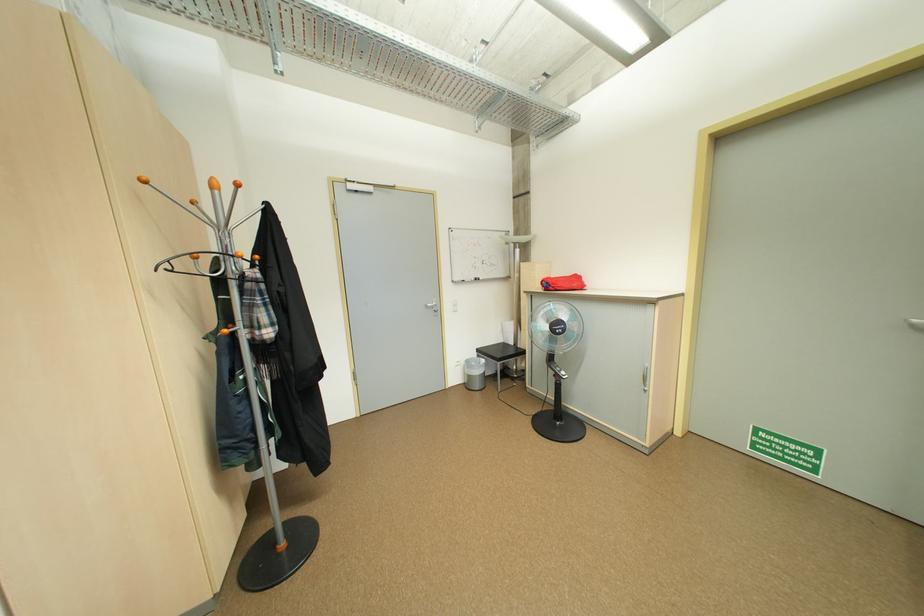
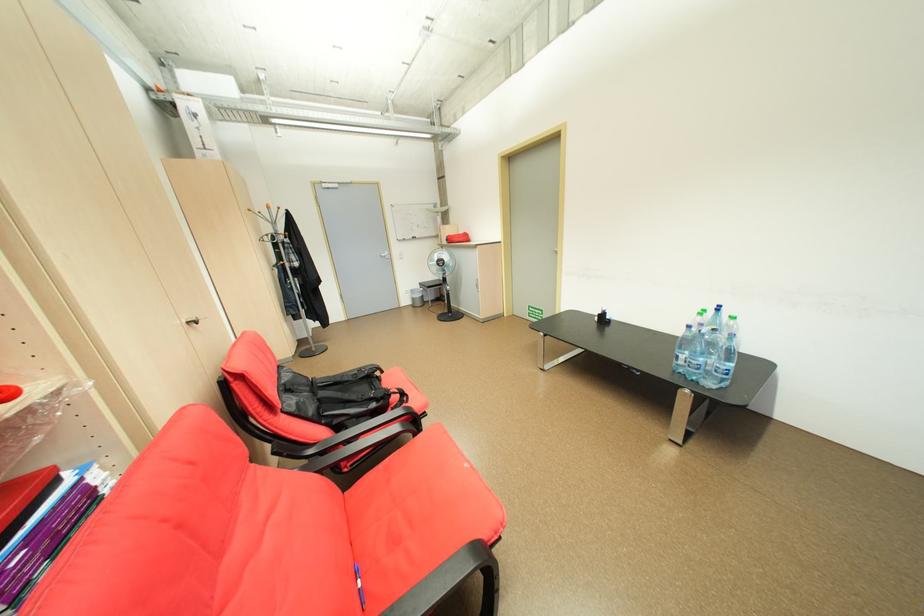
Locate, in the second image, the point that corresponds to point (464, 379) in the first image.

(415, 302)